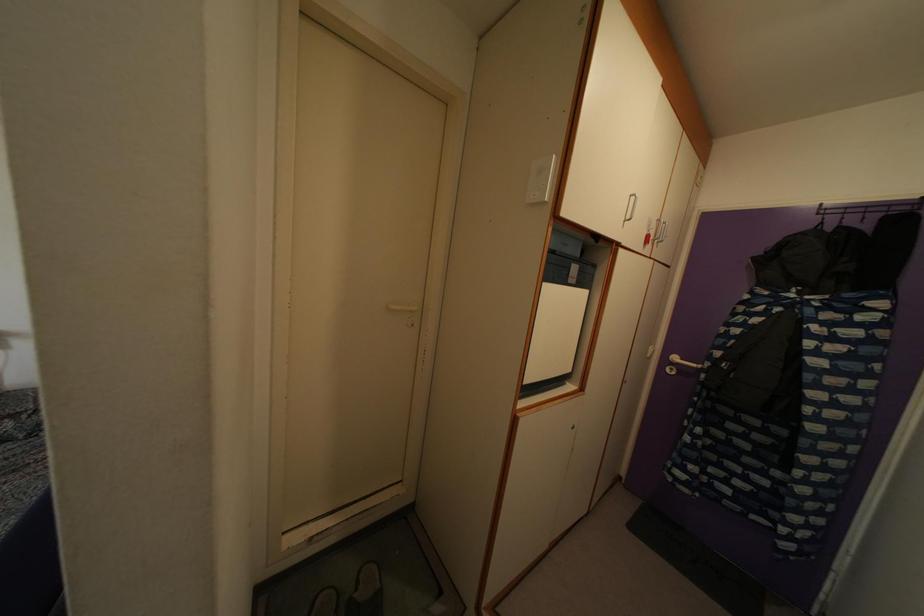
Which object does [541,179] point to?

This point indicates the white light switch.